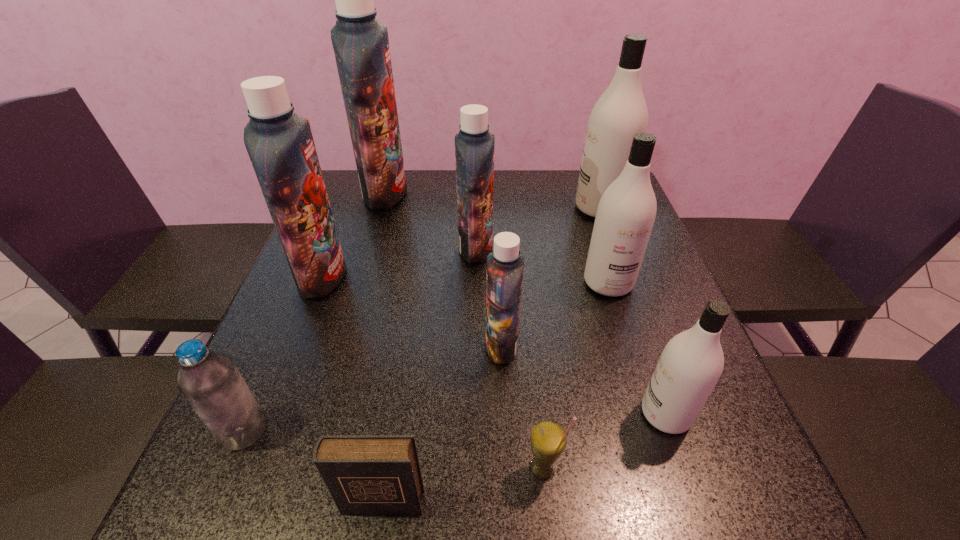
The height and width of the screenshot is (540, 960). Find the location of `vacant space situated 0.190m on the front label of the third biggest blue shampoo`. vacant space situated 0.190m on the front label of the third biggest blue shampoo is located at coordinates (566, 248).

Where is `vacant area situated on the front-facing side of the second nearest white shampoo`? Image resolution: width=960 pixels, height=540 pixels. vacant area situated on the front-facing side of the second nearest white shampoo is located at coordinates (619, 316).

At what (x,y) coordinates should I click in order to perform the action: click on vacant position located 0.170m on the front label of the fifth nearest object. Please return your answer as a coordinate pair (x, y). Looking at the image, I should click on (402, 346).

Image resolution: width=960 pixels, height=540 pixels. What are the coordinates of `free space located on the front label of the fifth nearest object` in the screenshot? It's located at (396, 346).

Identify the location of free space located 0.080m on the front label of the fifth nearest object. This screenshot has height=540, width=960. (446, 346).

At what (x,y) coordinates should I click in order to perform the action: click on blank space located on the front-facing side of the nearest shampoo. Please return your answer as a coordinate pair (x, y). Looking at the image, I should click on (567, 414).

This screenshot has width=960, height=540. In order to click on vacant space located 0.310m on the front-facing side of the nearest shampoo in this screenshot , I will do `click(466, 414)`.

This screenshot has width=960, height=540. I want to click on vacant space located on the front-facing side of the nearest shampoo, so click(511, 414).

Where is `vacant space located on the back of the third shortest object`? Image resolution: width=960 pixels, height=540 pixels. vacant space located on the back of the third shortest object is located at coordinates (290, 323).

Identify the location of free region located on the right of the straw for drinking. (710, 469).